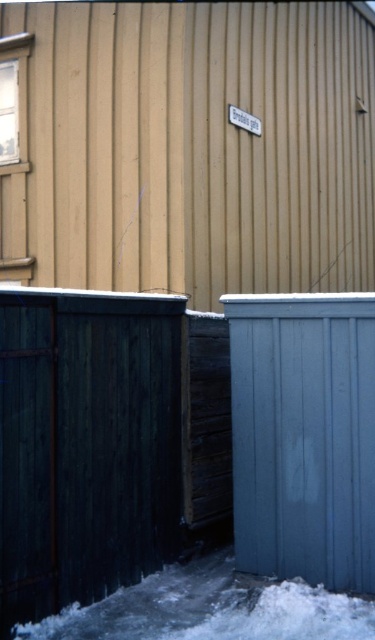
Is the position of dark green wooden fence at left more distant than that of blue painted wood fence at lower right?

No, dark green wooden fence at left is closer to the viewer.

Can you confirm if dark green wooden fence at left is wider than blue painted wood fence at lower right?

Indeed, dark green wooden fence at left has a greater width compared to blue painted wood fence at lower right.

At what (x,y) coordinates should I click in order to perform the action: click on dark green wooden fence at left. Please return your answer as a coordinate pair (x, y). This screenshot has height=640, width=375. Looking at the image, I should click on (85, 445).

This screenshot has height=640, width=375. I want to click on dark green wooden fence at left, so pos(85,445).

Who is positioned more to the left, dark green wooden fence at left or white powdery snow at lower center?

dark green wooden fence at left is more to the left.

Between point (37, 342) and point (187, 577), which one is positioned in front?

Positioned in front is point (37, 342).

Does point (34, 547) lie behind point (258, 621)?

No, it is in front of (258, 621).

The height and width of the screenshot is (640, 375). Find the location of `dark green wooden fence at left`. dark green wooden fence at left is located at coordinates (85, 445).

Can you confirm if blue painted wood fence at lower right is positioned above white powdery snow at lower center?

Correct, blue painted wood fence at lower right is located above white powdery snow at lower center.

Between blue painted wood fence at lower right and white powdery snow at lower center, which one is positioned higher?

blue painted wood fence at lower right

Which is in front, point (246, 499) or point (187, 577)?

Point (246, 499) is more forward.

Find the location of a particular element. Image resolution: width=375 pixels, height=640 pixels. blue painted wood fence at lower right is located at coordinates (304, 435).